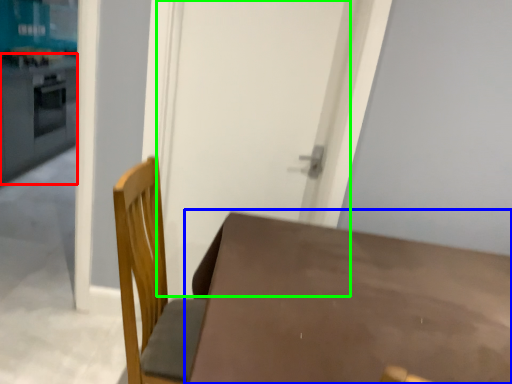
Question: Based on their relative distances, which object is nearer to counter top (highlighted by a red box)? Choose from table (highlighted by a blue box) and screen door (highlighted by a green box).

Choices:
 (A) table
 (B) screen door

Answer: (B)